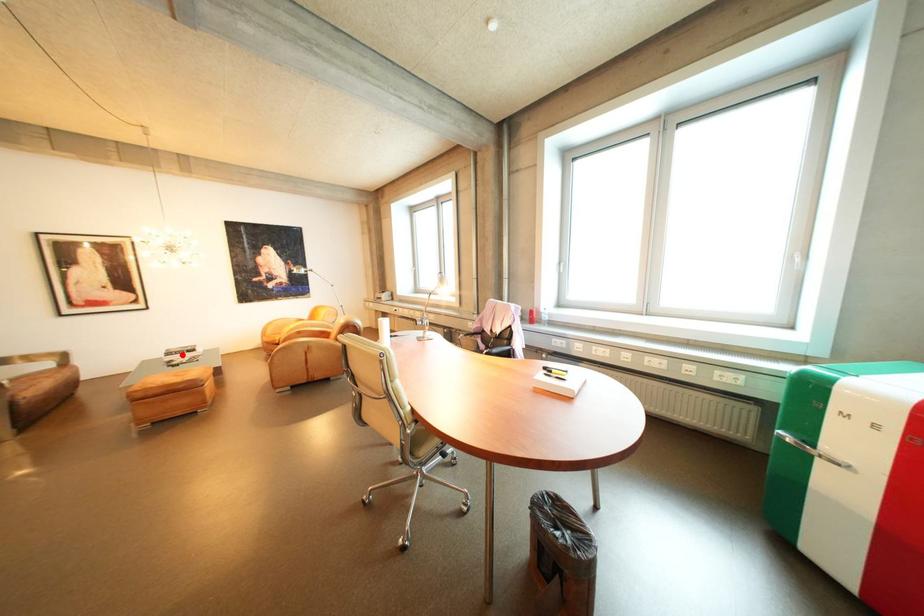
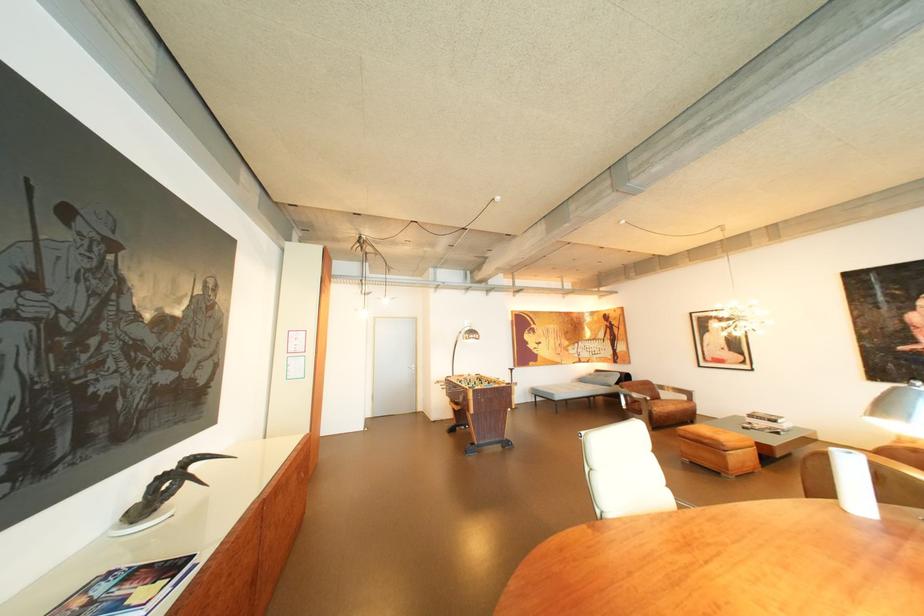
The point at the highlighted location is marked in the first image. Where is the corresponding point in the second image?

(763, 416)